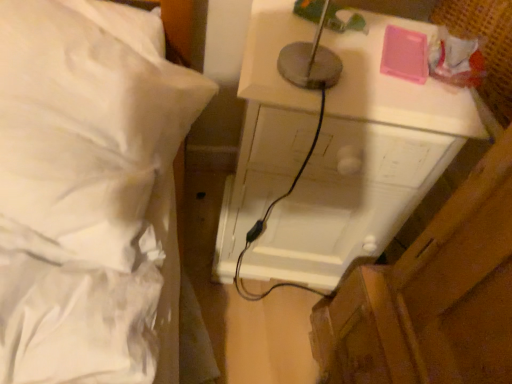
This screenshot has width=512, height=384. I want to click on free space above white glossy nightstand at upper right (from a real-world perspective), so click(358, 52).